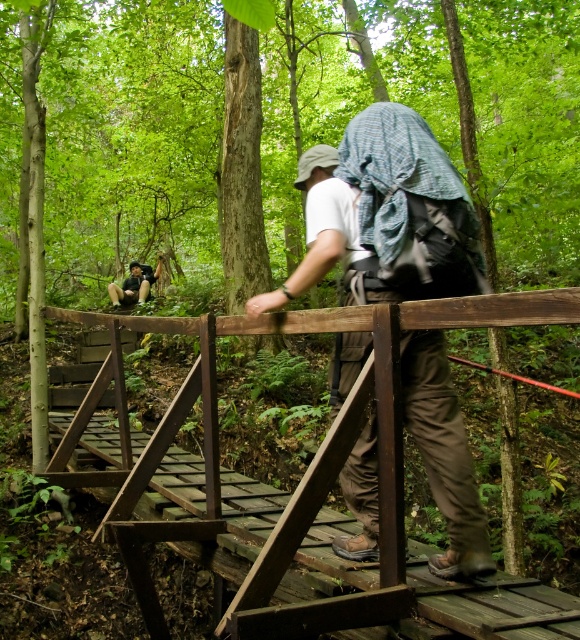
You are planning to cross the rustic wooden bridge at center while carrying the matte black backpack at lower left. Considering their sizes, will the backpack fit comfortably on your back without hindering your movement?

The rustic wooden bridge at center has a larger size compared to matte black backpack at lower left, so the backpack should fit comfortably on your back without hindering your movement.

You are standing on the wooden bridge in the forest and want to take a photo of two specific points on the bridge. The first point is at coordinates point (375, 476) and the second is at point (371, 380). Which point should you focus on first if you want to capture both points clearly in your photo?

You should focus on point (375, 476) first because it is closer to the camera than point (371, 380). This ensures that the closer point will be in focus, and the farther point will also be within the depth of field.